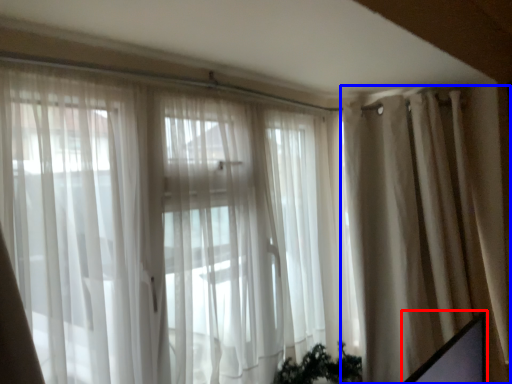
Question: Which object is further to the camera taking this photo, computer screen (highlighted by a red box) or curtain (highlighted by a blue box)?

Choices:
 (A) computer screen
 (B) curtain

Answer: (B)